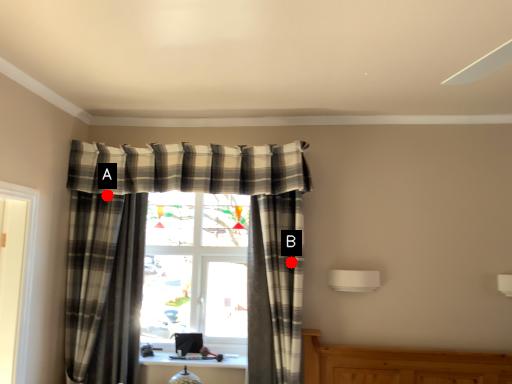
Question: Two points are circled on the image, labeled by A and B beside each circle. Which point appears closest to the camera in this image?

Choices:
 (A) A is closer
 (B) B is closer

Answer: (B)